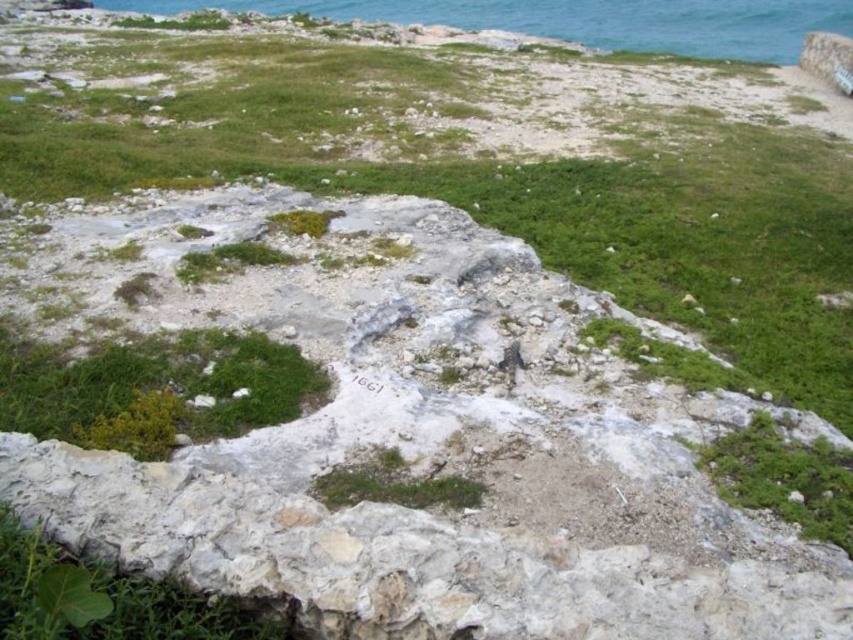
You are a hiker trying to navigate this coastal area. You need to cross from the rocks to the blue water at upper right. There is green leafy grass at center in your path. Can you step over the grass without bending down?

The green leafy grass at center is not as tall as the blue water at upper right. Since the grass is shorter than the water, you can likely step over it without bending down.

You are a hiker standing at the edge of the coastal path. You see the green leafy grass at center and the blue water at upper right. Which object is located to the right side of the other?

The green leafy grass at center is to the right of blue water at upper right, so the grass is positioned to the right side of the water.